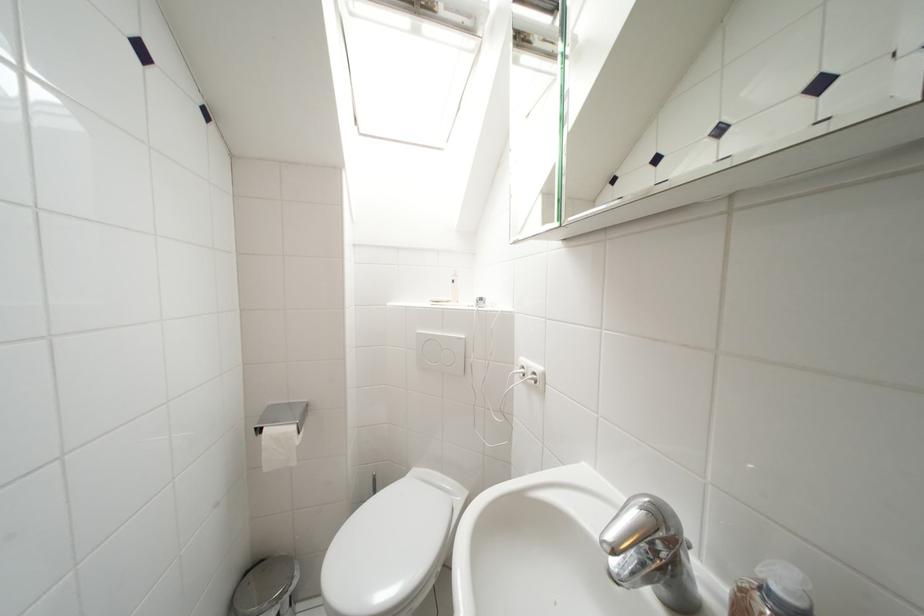
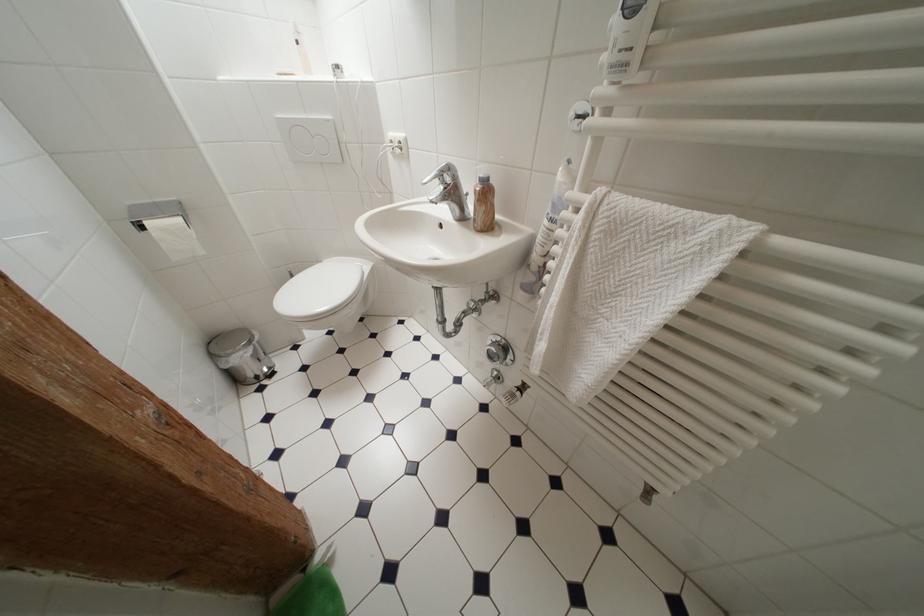
Where in the second image is the point corresponding to pixel 283 424 from the first image?

(160, 219)